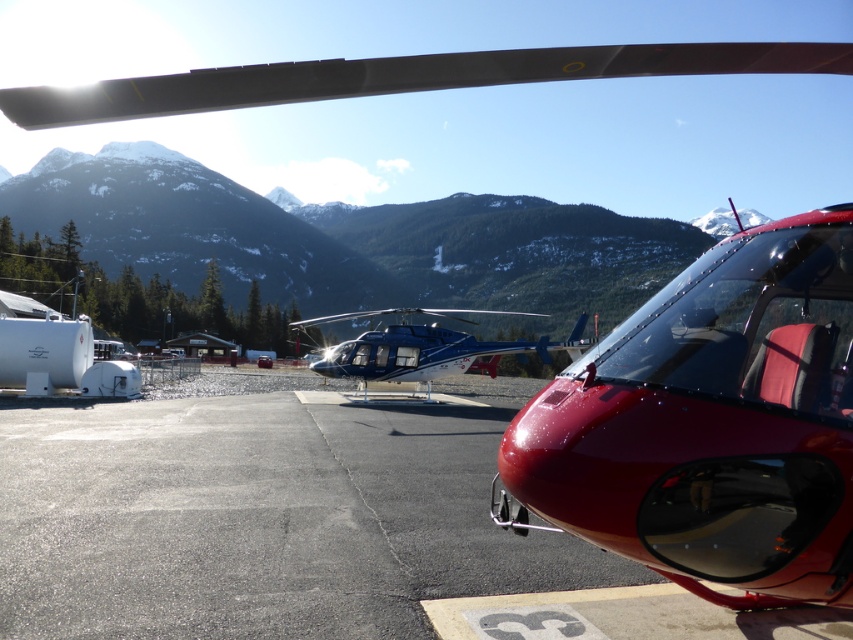
Can you confirm if snowy forested mountain at upper center is positioned below metallic blue helicopter at center?

Actually, snowy forested mountain at upper center is above metallic blue helicopter at center.

Is snowy forested mountain at upper center smaller than metallic blue helicopter at center?

No, snowy forested mountain at upper center is not smaller than metallic blue helicopter at center.

Between point (248, 264) and point (404, 365), which one is positioned in front?

Point (404, 365) is more forward.

Where is `snowy forested mountain at upper center`? The image size is (853, 640). snowy forested mountain at upper center is located at coordinates (351, 240).

Does smooth asphalt tarmac at center have a lesser height compared to snowy forested mountain at upper center?

Yes, smooth asphalt tarmac at center is shorter than snowy forested mountain at upper center.

Who is more forward, (368, 524) or (433, 200)?

Point (368, 524) is in front.

What are the coordinates of `smooth asphalt tarmac at center` in the screenshot? It's located at (259, 518).

From the picture: Is smooth asphalt tarmac at center to the left of shiny red helicopter at center from the viewer's perspective?

Correct, you'll find smooth asphalt tarmac at center to the left of shiny red helicopter at center.

Between point (283, 548) and point (671, 364), which one is positioned in front?

Point (671, 364)

Identify the location of smooth asphalt tarmac at center. (259, 518).